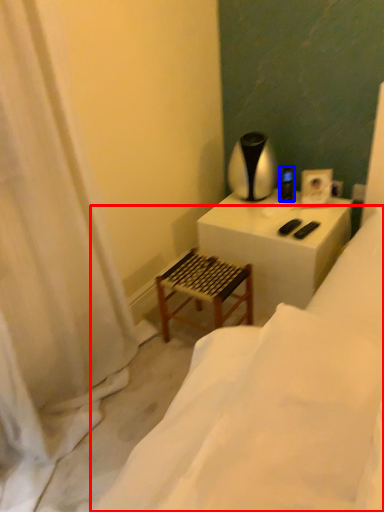
Question: Which point is closer to the camera, furniture (highlighted by a red box) or appliance (highlighted by a blue box)?

Choices:
 (A) furniture
 (B) appliance

Answer: (A)